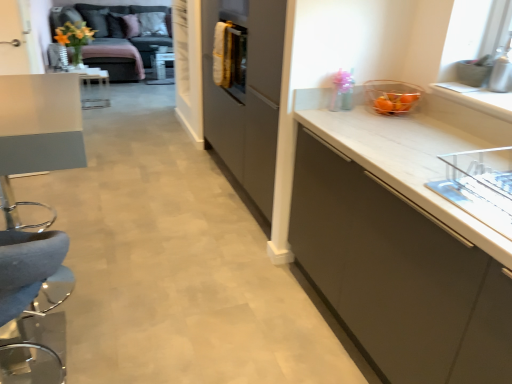
Question: Does velvet grey couch at upper left come in front of matte gray table at left?

Choices:
 (A) no
 (B) yes

Answer: (A)

Question: Could you tell me if velvet grey couch at upper left is facing matte gray table at left?

Choices:
 (A) yes
 (B) no

Answer: (A)

Question: Considering the relative sizes of velvet grey couch at upper left and matte gray table at left in the image provided, is velvet grey couch at upper left taller than matte gray table at left?

Choices:
 (A) no
 (B) yes

Answer: (A)

Question: Considering the relative sizes of velvet grey couch at upper left and matte gray table at left in the image provided, is velvet grey couch at upper left smaller than matte gray table at left?

Choices:
 (A) yes
 (B) no

Answer: (B)

Question: Does velvet grey couch at upper left have a lesser height compared to matte gray table at left?

Choices:
 (A) yes
 (B) no

Answer: (A)

Question: Is velvet grey couch at upper left behind matte gray table at left?

Choices:
 (A) yes
 (B) no

Answer: (A)

Question: Can you confirm if matte yellow flower at upper left is shorter than velvet grey couch at upper left?

Choices:
 (A) no
 (B) yes

Answer: (B)

Question: Is matte yellow flower at upper left turned away from velvet grey couch at upper left?

Choices:
 (A) yes
 (B) no

Answer: (A)

Question: From the image's perspective, does matte yellow flower at upper left appear lower than velvet grey couch at upper left?

Choices:
 (A) yes
 (B) no

Answer: (A)

Question: Is matte yellow flower at upper left to the left of velvet grey couch at upper left from the viewer's perspective?

Choices:
 (A) yes
 (B) no

Answer: (A)

Question: Is matte yellow flower at upper left directly adjacent to velvet grey couch at upper left?

Choices:
 (A) yes
 (B) no

Answer: (B)

Question: Is matte yellow flower at upper left aimed at velvet grey couch at upper left?

Choices:
 (A) no
 (B) yes

Answer: (B)

Question: Is matte gray table at left far from white matte cabinet at right?

Choices:
 (A) yes
 (B) no

Answer: (A)